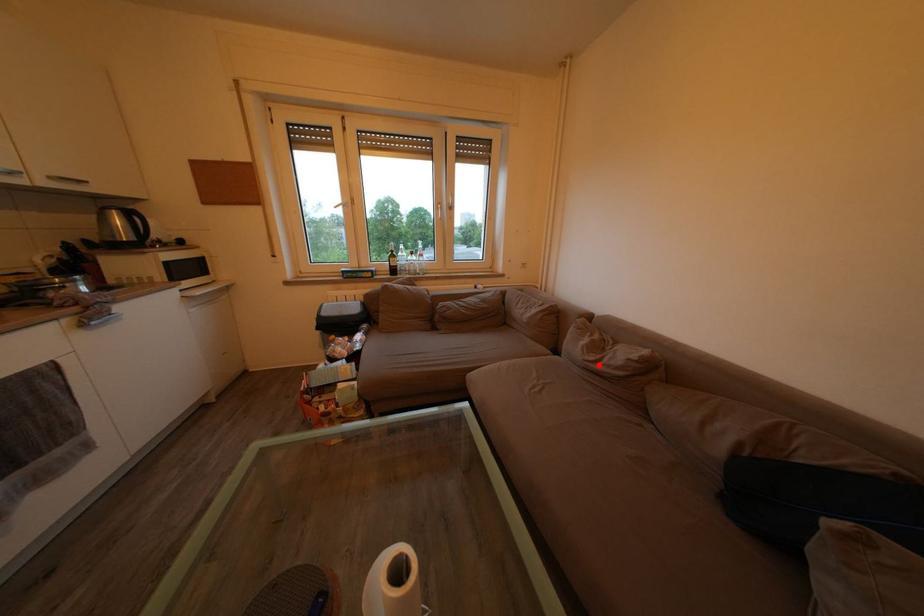
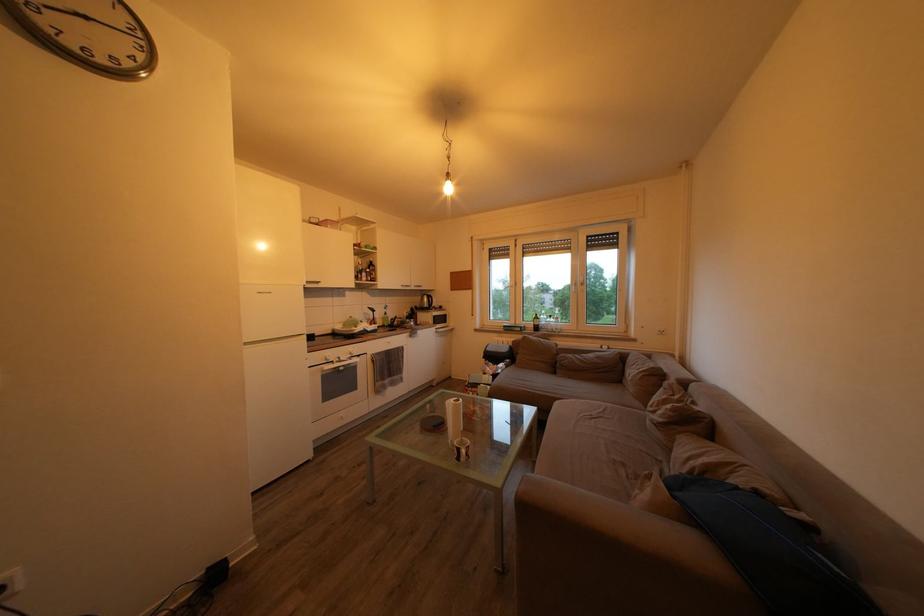
Where in the second image is the point corresponding to the highlighted location from the first image?

(659, 416)